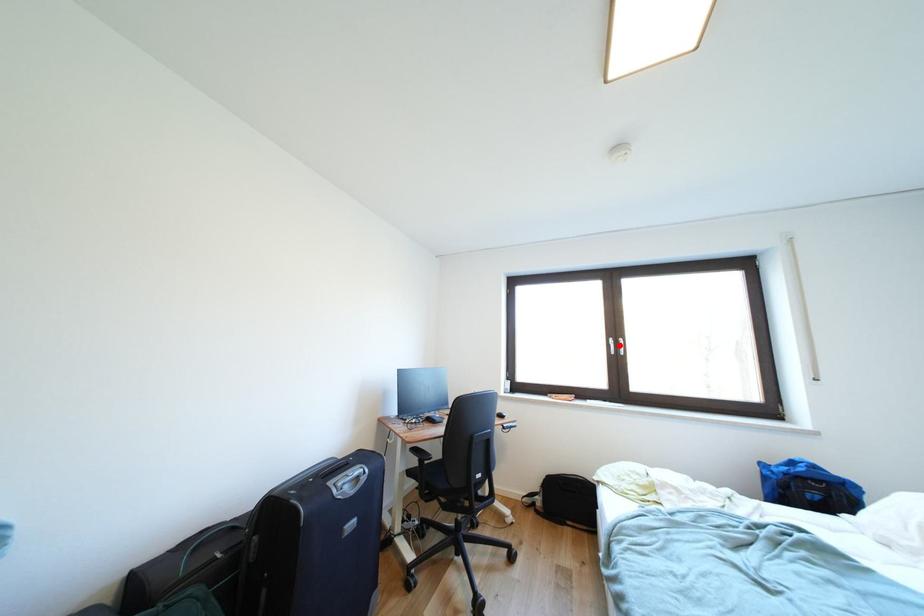
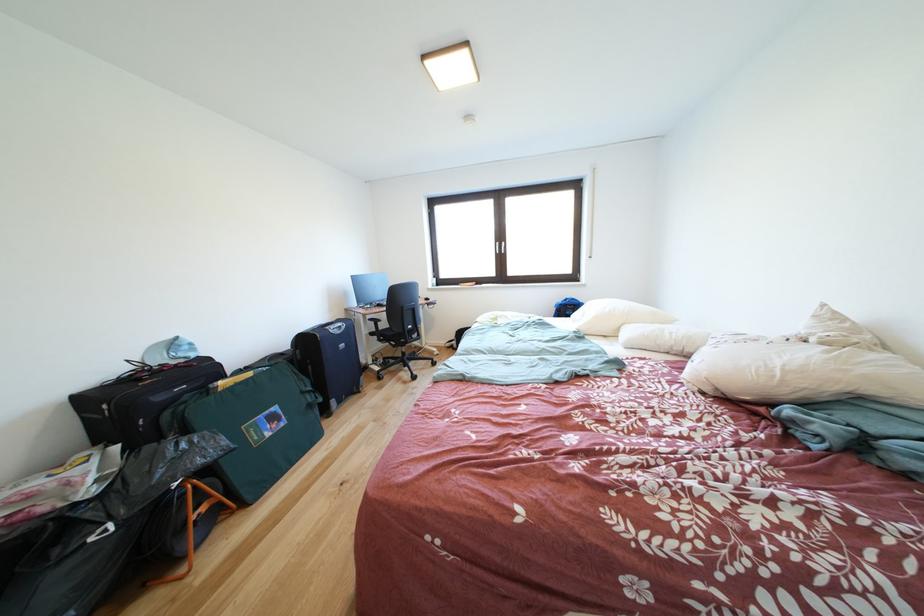
Where in the second image is the point corresponding to the highlighted location from the first image?

(505, 249)